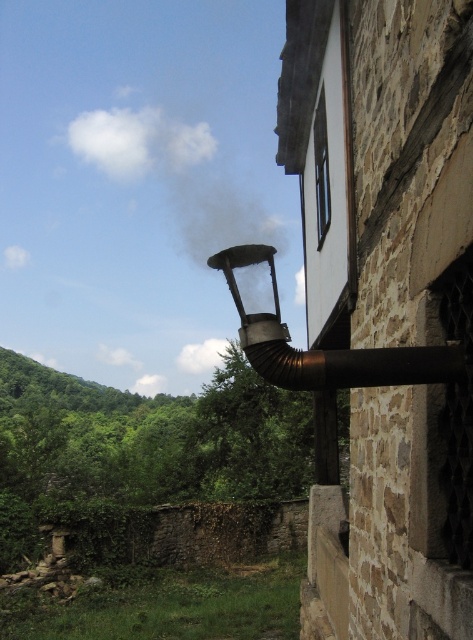
Is white smoke at upper center taller than bronze metallic chimney at upper right?

Yes, white smoke at upper center is taller than bronze metallic chimney at upper right.

Is point (97, 116) farther from camera compared to point (278, 342)?

Yes, it is behind point (278, 342).

Which is behind, point (128, 122) or point (322, 376)?

The point (128, 122) is behind.

Find the location of a particular element. This screenshot has height=640, width=473. white smoke at upper center is located at coordinates (175, 173).